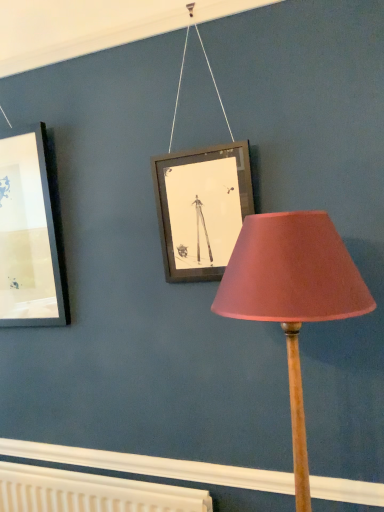
Question: Should I look upward or downward to see pink fabric lampshade at center?

Choices:
 (A) down
 (B) up

Answer: (A)

Question: Is the depth of white textured radiator at lower center greater than that of pink fabric lampshade at center?

Choices:
 (A) no
 (B) yes

Answer: (B)

Question: Is white textured radiator at lower center positioned in front of pink fabric lampshade at center?

Choices:
 (A) yes
 (B) no

Answer: (B)

Question: Is white textured radiator at lower center looking in the opposite direction of pink fabric lampshade at center?

Choices:
 (A) yes
 (B) no

Answer: (B)

Question: Considering the relative positions of white textured radiator at lower center and pink fabric lampshade at center in the image provided, is white textured radiator at lower center to the left of pink fabric lampshade at center from the viewer's perspective?

Choices:
 (A) yes
 (B) no

Answer: (A)

Question: Is white textured radiator at lower center shorter than pink fabric lampshade at center?

Choices:
 (A) no
 (B) yes

Answer: (B)

Question: Considering the relative sizes of white textured radiator at lower center and pink fabric lampshade at center in the image provided, is white textured radiator at lower center smaller than pink fabric lampshade at center?

Choices:
 (A) yes
 (B) no

Answer: (A)

Question: Is pink fabric lampshade at center thinner than white textured radiator at lower center?

Choices:
 (A) no
 (B) yes

Answer: (A)

Question: Considering the relative sizes of pink fabric lampshade at center and white textured radiator at lower center in the image provided, is pink fabric lampshade at center smaller than white textured radiator at lower center?

Choices:
 (A) yes
 (B) no

Answer: (B)

Question: Does pink fabric lampshade at center come behind white textured radiator at lower center?

Choices:
 (A) no
 (B) yes

Answer: (A)

Question: Considering the relative sizes of pink fabric lampshade at center and white textured radiator at lower center in the image provided, is pink fabric lampshade at center shorter than white textured radiator at lower center?

Choices:
 (A) no
 (B) yes

Answer: (A)

Question: From the image's perspective, would you say pink fabric lampshade at center is shown under white textured radiator at lower center?

Choices:
 (A) yes
 (B) no

Answer: (B)

Question: Is pink fabric lampshade at center facing away from white textured radiator at lower center?

Choices:
 (A) no
 (B) yes

Answer: (A)

Question: From the image's perspective, relative to pink fabric lampshade at center, is white textured radiator at lower center above or below?

Choices:
 (A) below
 (B) above

Answer: (A)